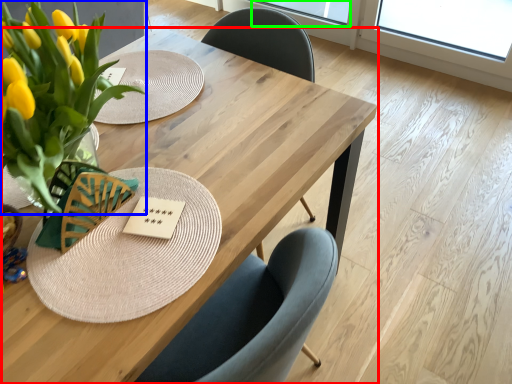
Question: Which object is the farthest from table (highlighted by a red box)? Choose among these: floral arrangement (highlighted by a blue box) or window screen (highlighted by a green box).

Choices:
 (A) floral arrangement
 (B) window screen

Answer: (B)